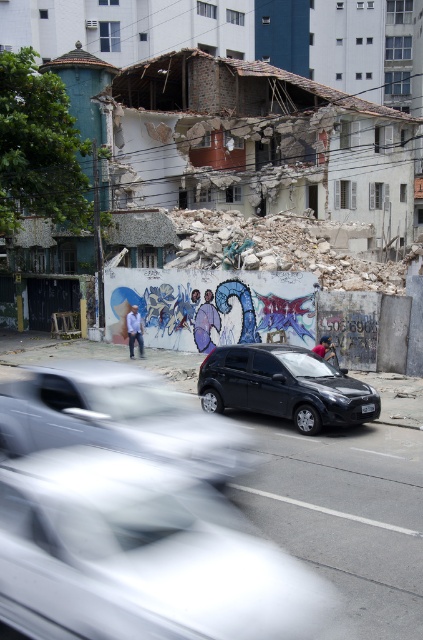
Question: Can you confirm if white glossy car at center is wider than metallic silver car at center?

Choices:
 (A) yes
 (B) no

Answer: (B)

Question: Estimate the real-world distances between objects in this image. Which object is farther from the metallic silver car at center?

Choices:
 (A) white glossy car at center
 (B) black matte hatchback at center

Answer: (A)

Question: Is white glossy car at center bigger than black matte hatchback at center?

Choices:
 (A) yes
 (B) no

Answer: (B)

Question: Which is nearer to the black matte hatchback at center?

Choices:
 (A) white glossy car at center
 (B) metallic silver car at center

Answer: (B)

Question: Is white glossy car at center to the right of black matte hatchback at center from the viewer's perspective?

Choices:
 (A) no
 (B) yes

Answer: (A)

Question: Considering the real-world distances, which object is closest to the black matte hatchback at center?

Choices:
 (A) white glossy car at center
 (B) metallic silver car at center

Answer: (B)